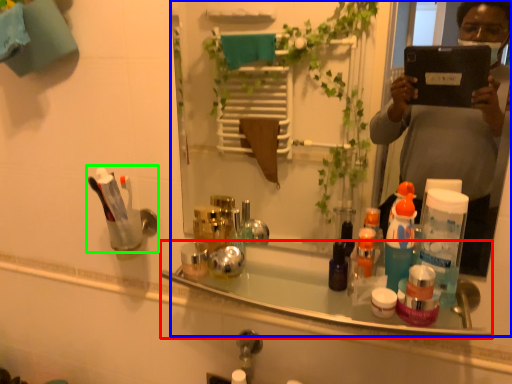
Question: Which is farther away from bath (highlighted by a red box)? mirror (highlighted by a blue box) or toiletry (highlighted by a green box)?

Choices:
 (A) mirror
 (B) toiletry

Answer: (A)